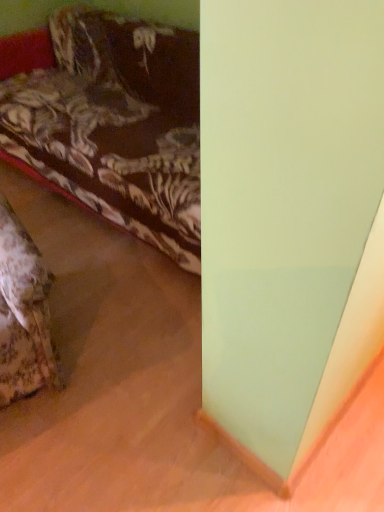
What is the approximate height of brown floral fabric couch at left?

It is 69.18 centimeters.

Find the location of a particular element. The width and height of the screenshot is (384, 512). brown floral fabric couch at left is located at coordinates (115, 124).

From the picture: What is the approximate width of brown floral fabric couch at left?

The width of brown floral fabric couch at left is 38.59 inches.

What do you see at coordinates (115, 124) in the screenshot? I see `brown floral fabric couch at left` at bounding box center [115, 124].

Identify the location of brown floral fabric couch at left. Image resolution: width=384 pixels, height=512 pixels. (115, 124).